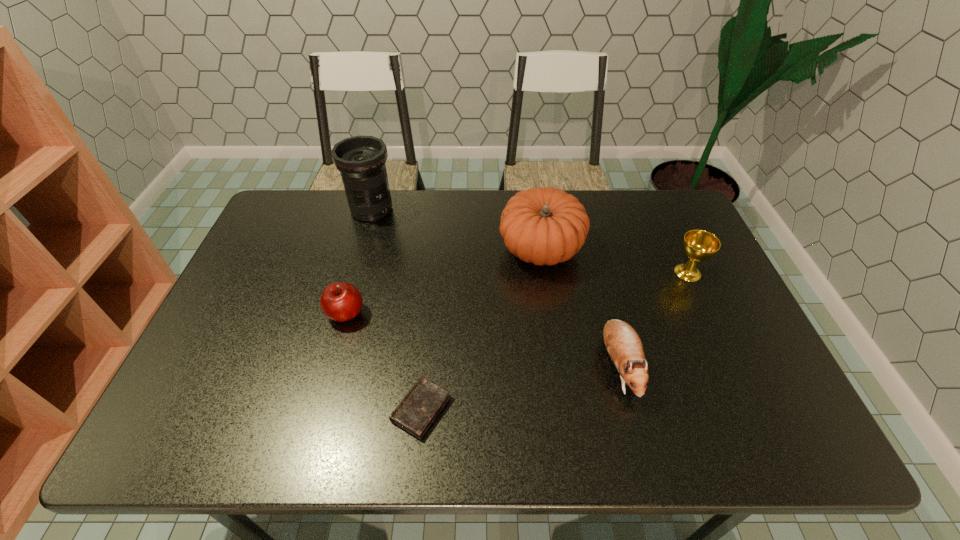
Identify the location of vacant space in between the shortest object and the third nearest object. This screenshot has height=540, width=960. [x=383, y=361].

Identify the location of free space between the fourth object from right to left and the second tallest object. The height and width of the screenshot is (540, 960). (481, 328).

Where is `the fourth closest object relative to the hamster`? The height and width of the screenshot is (540, 960). the fourth closest object relative to the hamster is located at coordinates tap(340, 301).

Where is `object that can be found as the second closest to the apple`? Image resolution: width=960 pixels, height=540 pixels. object that can be found as the second closest to the apple is located at coordinates (361, 160).

Where is `vacant space that satisfies the following two spatial constraints: 1. on the front side of the tallest object; 2. on the right side of the fourth farthest object`? The image size is (960, 540). vacant space that satisfies the following two spatial constraints: 1. on the front side of the tallest object; 2. on the right side of the fourth farthest object is located at coordinates (343, 314).